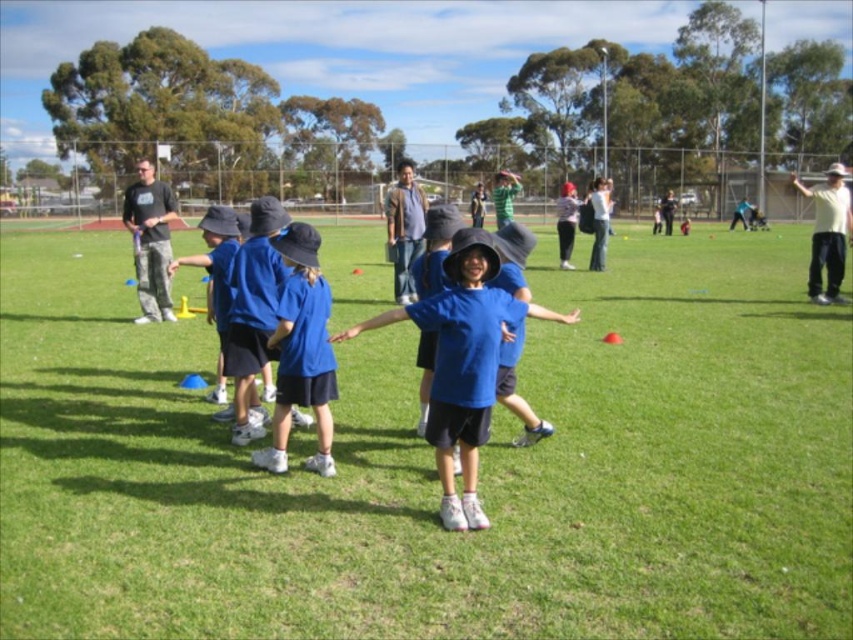
Is blue fabric shirt at center bigger than blue matte hat at center?

Yes.

Who is more distant from viewer, (828, 500) or (265, 465)?

The point (265, 465) is more distant.

You are a GUI agent. You are given a task and a screenshot of the screen. Output one action in this format:
    pyautogui.click(x=<x>, y=<y>)
    Task: Click on the blue fabric shirt at center
    This screenshot has width=853, height=640.
    Given the screenshot: What is the action you would take?
    pyautogui.click(x=433, y=468)

Does blue matte shirt at center have a greater height compared to blue matte hat at center?

No.

Can you confirm if blue matte shirt at center is positioned below blue matte hat at center?

Yes, blue matte shirt at center is below blue matte hat at center.

You are a GUI agent. You are given a task and a screenshot of the screen. Output one action in this format:
    pyautogui.click(x=<x>, y=<y>)
    Task: Click on the blue matte shirt at center
    Image resolution: width=853 pixels, height=640 pixels.
    Given the screenshot: What is the action you would take?
    pyautogui.click(x=463, y=362)

Who is lower down, blue fabric shirt at center or blue matte shirt at center?

blue matte shirt at center is lower down.

Where is `blue fabric shirt at center`? This screenshot has height=640, width=853. blue fabric shirt at center is located at coordinates tap(433, 468).

This screenshot has width=853, height=640. Identify the location of blue fabric shirt at center. (433, 468).